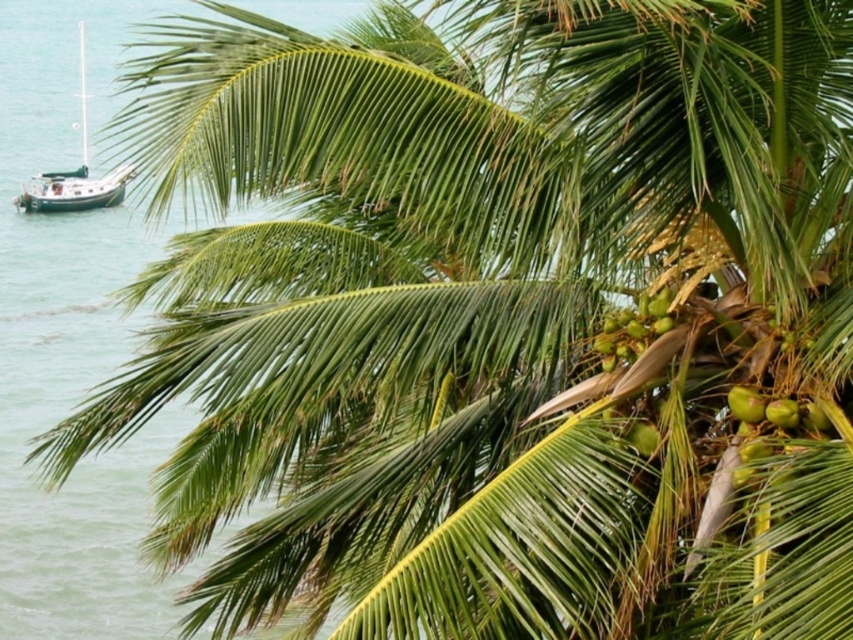
Is point (123, 188) positioned behind point (663, 328)?

Yes.

Between wooden sailboat at left and green matte coconuts at upper right, which one is positioned lower?

green matte coconuts at upper right

Between point (38, 188) and point (640, 316), which one is positioned in front?

Point (640, 316)

Identify the location of wooden sailboat at left. Image resolution: width=853 pixels, height=640 pixels. (74, 172).

Does green matte coconuts at upper right have a larger size compared to green matte coconut at upper right?

Correct, green matte coconuts at upper right is larger in size than green matte coconut at upper right.

Which of these two, green matte coconuts at upper right or green matte coconut at upper right, stands taller?

green matte coconuts at upper right is taller.

Image resolution: width=853 pixels, height=640 pixels. What do you see at coordinates (631, 328) in the screenshot?
I see `green matte coconuts at upper right` at bounding box center [631, 328].

Where is `green matte coconuts at upper right`? The height and width of the screenshot is (640, 853). green matte coconuts at upper right is located at coordinates (x=631, y=328).

Is wooden sailboat at left further to the viewer compared to green matte coconut at upper right?

Yes, it is.

Which of these two, wooden sailboat at left or green matte coconut at upper right, stands shorter?

green matte coconut at upper right is shorter.

Who is more forward, (56,192) or (751,392)?

Point (751,392) is more forward.

Find the location of a particular element. This screenshot has width=853, height=640. wooden sailboat at left is located at coordinates (74, 172).